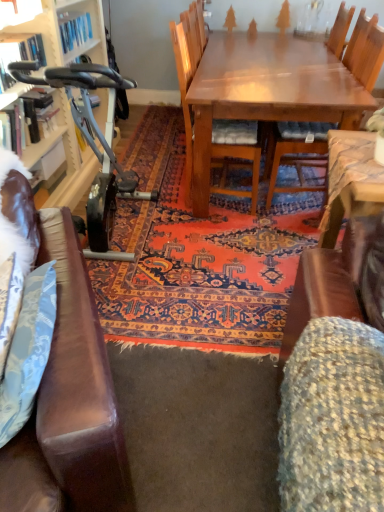
This screenshot has width=384, height=512. In order to click on fluffy fabric swivel chair at lower right in this screenshot , I will do `click(336, 380)`.

Where is `metallic blue exercise bike at left`? metallic blue exercise bike at left is located at coordinates [94, 146].

Where is `wooden chair at center, which is the second chair from right to left`? The height and width of the screenshot is (512, 384). wooden chair at center, which is the second chair from right to left is located at coordinates point(188,72).

Is wooden chair at center, which is counted as the first chair, starting from the left, outside of wooden chair at center, which is counted as the 1th chair, starting from the right?

Indeed, wooden chair at center, which is counted as the first chair, starting from the left, is completely outside wooden chair at center, which is counted as the 1th chair, starting from the right.

From the image's perspective, which is below, wooden chair at center, which is the second chair from right to left, or wooden chair at center, which is counted as the 1th chair, starting from the right?

wooden chair at center, which is the second chair from right to left, is shown below in the image.

Considering the relative positions of wooden chair at center, which is counted as the first chair, starting from the left, and wooden chair at center, which is counted as the 1th chair, starting from the right, in the image provided, is wooden chair at center, which is counted as the first chair, starting from the left, to the right of wooden chair at center, which is counted as the 1th chair, starting from the right, from the viewer's perspective?

No.

Are wooden chair at center, which is counted as the first chair, starting from the left, and wooden chair at center, positioned as the 2th chair in left-to-right order, far apart?

No, wooden chair at center, which is counted as the first chair, starting from the left, is not far away from wooden chair at center, positioned as the 2th chair in left-to-right order.

Considering the relative positions of fluffy fabric swivel chair at lower right and wooden bookcase at left in the image provided, is fluffy fabric swivel chair at lower right to the left or to the right of wooden bookcase at left?

From the image, it's evident that fluffy fabric swivel chair at lower right is to the right of wooden bookcase at left.

At what (x,y) coordinates should I click in order to perform the action: click on bookcase above the fluffy fabric swivel chair at lower right (from a real-world perspective). Please return your answer as a coordinate pair (x, y). Image resolution: width=384 pixels, height=512 pixels. Looking at the image, I should click on (59, 30).

Is fluffy fabric swivel chair at lower right in front of wooden bookcase at left?

Yes, the depth of fluffy fabric swivel chair at lower right is less than that of wooden bookcase at left.

Considering the relative sizes of fluffy fabric swivel chair at lower right and wooden bookcase at left in the image provided, is fluffy fabric swivel chair at lower right shorter than wooden bookcase at left?

Correct, fluffy fabric swivel chair at lower right is not as tall as wooden bookcase at left.

Between fluffy fabric swivel chair at lower right and metallic blue exercise bike at left, which one has larger width?

With larger width is fluffy fabric swivel chair at lower right.

From a real-world perspective, is fluffy fabric swivel chair at lower right physically located above or below metallic blue exercise bike at left?

From a real-world perspective, fluffy fabric swivel chair at lower right is physically below metallic blue exercise bike at left.

Is fluffy fabric swivel chair at lower right to the left of metallic blue exercise bike at left from the viewer's perspective?

No.

Is fluffy fabric swivel chair at lower right spatially inside metallic blue exercise bike at left, or outside of it?

The correct answer is: outside.

Can you confirm if wooden bookcase at left is wider than wooden chair at center, positioned as the 2th chair in left-to-right order?

In fact, wooden bookcase at left might be narrower than wooden chair at center, positioned as the 2th chair in left-to-right order.

Is wooden bookcase at left behind wooden chair at center, which is counted as the 1th chair, starting from the right?

No.

Who is smaller, wooden bookcase at left or wooden chair at center, positioned as the 2th chair in left-to-right order?

With smaller size is wooden bookcase at left.

How different are the orientations of wooden bookcase at left and wooden chair at center, which is counted as the 1th chair, starting from the right, in degrees?

The angle between the facing direction of wooden bookcase at left and the facing direction of wooden chair at center, which is counted as the 1th chair, starting from the right, is 179 degrees.

Where is `sport equipment in front of the wooden chair at center, which is the second chair from right to left`? sport equipment in front of the wooden chair at center, which is the second chair from right to left is located at coordinates (94, 146).

Is wooden chair at center, which is the second chair from right to left, oriented away from metallic blue exercise bike at left?

No, wooden chair at center, which is the second chair from right to left, is not facing away from metallic blue exercise bike at left.

From the image's perspective, is wooden chair at center, which is counted as the first chair, starting from the left, over metallic blue exercise bike at left?

Yes, from the image's perspective, wooden chair at center, which is counted as the first chair, starting from the left, is on top of metallic blue exercise bike at left.

Considering the sizes of objects wooden chair at center, which is the second chair from right to left, and metallic blue exercise bike at left in the image provided, who is thinner, wooden chair at center, which is the second chair from right to left, or metallic blue exercise bike at left?

metallic blue exercise bike at left is thinner.

Consider the image. Does wooden chair at center, positioned as the 2th chair in left-to-right order, appear on the left side of metallic blue exercise bike at left?

Incorrect, wooden chair at center, positioned as the 2th chair in left-to-right order, is not on the left side of metallic blue exercise bike at left.

From a real-world perspective, which object rests below the other?

metallic blue exercise bike at left is physically lower.

From the image's perspective, count 2nd chairs upward from the metallic blue exercise bike at left and point to it. Please provide its 2D coordinates.

[(296, 152)]

Is wooden chair at center, positioned as the 2th chair in left-to-right order, wider than metallic blue exercise bike at left?

Indeed, wooden chair at center, positioned as the 2th chair in left-to-right order, has a greater width compared to metallic blue exercise bike at left.

Looking at this image, which of these two, wooden bookcase at left or fluffy fabric swivel chair at lower right, is wider?

fluffy fabric swivel chair at lower right is wider.

Based on the photo, measure the distance between wooden bookcase at left and fluffy fabric swivel chair at lower right.

They are 6.84 feet apart.

From the image's perspective, is wooden bookcase at left located above or below fluffy fabric swivel chair at lower right?

Clearly, from the image's perspective, wooden bookcase at left is above fluffy fabric swivel chair at lower right.

Between wooden bookcase at left and fluffy fabric swivel chair at lower right, which one appears on the right side from the viewer's perspective?

fluffy fabric swivel chair at lower right.

Identify the location of chair in front of the wooden chair at center, which is counted as the 1th chair, starting from the right. (188, 72).

This screenshot has width=384, height=512. Find the location of `swivel chair that appears on the right of wooden bookcase at left`. swivel chair that appears on the right of wooden bookcase at left is located at coordinates (336, 380).

Considering their positions, is metallic blue exercise bike at left positioned further to wooden bookcase at left than wooden chair at center, which is the second chair from right to left?

The object further to wooden bookcase at left is wooden chair at center, which is the second chair from right to left.

Looking at the image, which one is located closer to metallic blue exercise bike at left, wooden chair at center, which is the second chair from right to left, or fluffy fabric swivel chair at lower right?

Among the two, wooden chair at center, which is the second chair from right to left, is located nearer to metallic blue exercise bike at left.

From the image, which object appears to be nearer to metallic blue exercise bike at left, wooden chair at center, positioned as the 2th chair in left-to-right order, or wooden bookcase at left?

The object closer to metallic blue exercise bike at left is wooden bookcase at left.

Considering their positions, is wooden bookcase at left positioned further to fluffy fabric swivel chair at lower right than metallic blue exercise bike at left?

The object further to fluffy fabric swivel chair at lower right is wooden bookcase at left.

Which object lies further to the anchor point fluffy fabric swivel chair at lower right, wooden chair at center, which is counted as the first chair, starting from the left, or wooden chair at center, positioned as the 2th chair in left-to-right order?

wooden chair at center, which is counted as the first chair, starting from the left, is positioned further to the anchor fluffy fabric swivel chair at lower right.

From the image, which object appears to be nearer to wooden chair at center, which is counted as the 1th chair, starting from the right, wooden chair at center, which is the second chair from right to left, or metallic blue exercise bike at left?

wooden chair at center, which is the second chair from right to left.

In the scene shown: Which object lies nearer to the anchor point metallic blue exercise bike at left, wooden chair at center, which is the second chair from right to left, or wooden bookcase at left?

wooden bookcase at left is positioned closer to the anchor metallic blue exercise bike at left.

Which object lies nearer to the anchor point fluffy fabric swivel chair at lower right, wooden chair at center, positioned as the 2th chair in left-to-right order, or wooden chair at center, which is the second chair from right to left?

wooden chair at center, positioned as the 2th chair in left-to-right order, is closer to fluffy fabric swivel chair at lower right.

Locate an element on the screen. bookcase between metallic blue exercise bike at left and fluffy fabric swivel chair at lower right in the up-down direction is located at coordinates (59, 30).

The width and height of the screenshot is (384, 512). I want to click on sport equipment located between fluffy fabric swivel chair at lower right and wooden chair at center, which is counted as the 1th chair, starting from the right, in the depth direction, so click(94, 146).

At what (x,y) coordinates should I click in order to perform the action: click on chair situated between metallic blue exercise bike at left and wooden chair at center, positioned as the 2th chair in left-to-right order, from left to right. Please return your answer as a coordinate pair (x, y). The width and height of the screenshot is (384, 512). Looking at the image, I should click on (x=188, y=72).

Where is `chair positioned between fluffy fabric swivel chair at lower right and wooden chair at center, positioned as the 2th chair in left-to-right order, from near to far`? The width and height of the screenshot is (384, 512). chair positioned between fluffy fabric swivel chair at lower right and wooden chair at center, positioned as the 2th chair in left-to-right order, from near to far is located at coordinates (188, 72).